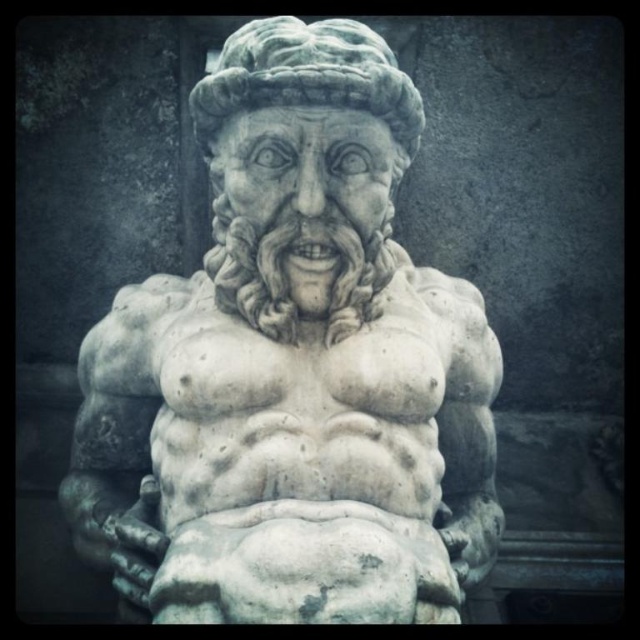
Question: Among these objects, which one is farthest from the camera?

Choices:
 (A) white marble head at center
 (B) white marble statue at center

Answer: (A)

Question: Which object appears farthest from the camera in this image?

Choices:
 (A) white marble statue at center
 (B) white marble head at center

Answer: (B)

Question: Does white marble statue at center have a greater width compared to white marble head at center?

Choices:
 (A) yes
 (B) no

Answer: (A)

Question: Does white marble statue at center appear over white marble head at center?

Choices:
 (A) yes
 (B) no

Answer: (B)

Question: Does white marble statue at center have a greater width compared to white marble head at center?

Choices:
 (A) yes
 (B) no

Answer: (A)